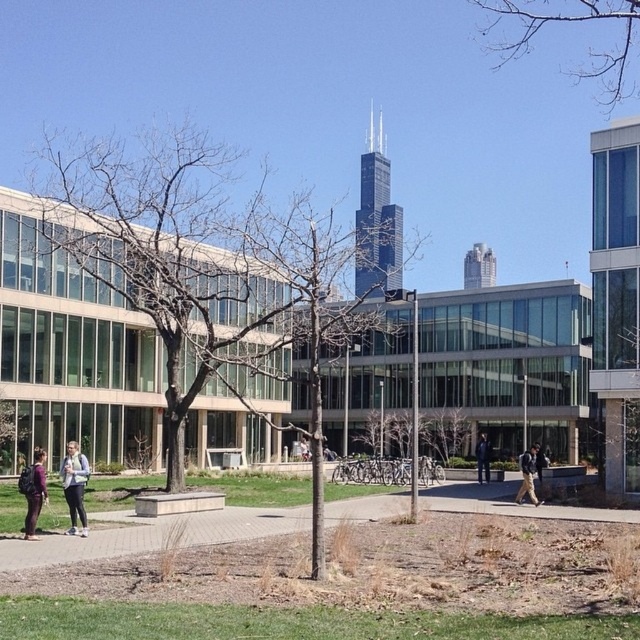
Does paved concrete sidewalk at lower center have a larger size compared to matte purple jacket at lower left?

Yes, paved concrete sidewalk at lower center is bigger than matte purple jacket at lower left.

Can you confirm if paved concrete sidewalk at lower center is positioned below matte purple jacket at lower left?

Yes, paved concrete sidewalk at lower center is below matte purple jacket at lower left.

Does point (204, 513) come in front of point (36, 497)?

That is False.

Identify the location of paved concrete sidewalk at lower center. (154, 534).

Who is more forward, [83,508] or [45,497]?

Point [45,497]

Is point (77, 465) in front of point (33, 497)?

No, (77, 465) is behind (33, 497).

Between point (83, 460) and point (35, 474), which one is positioned behind?

The point (83, 460) is behind.

Image resolution: width=640 pixels, height=640 pixels. Find the location of `matte white jacket at center`. matte white jacket at center is located at coordinates (74, 486).

Who is more forward, (394, 502) or (83, 496)?

Point (83, 496) is in front.

You are a GUI agent. You are given a task and a screenshot of the screen. Output one action in this format:
    pyautogui.click(x=<x>, y=<y>)
    Task: Click on the paved concrete sidewalk at lower center
    The image size is (640, 640).
    Given the screenshot: What is the action you would take?
    pyautogui.click(x=154, y=534)